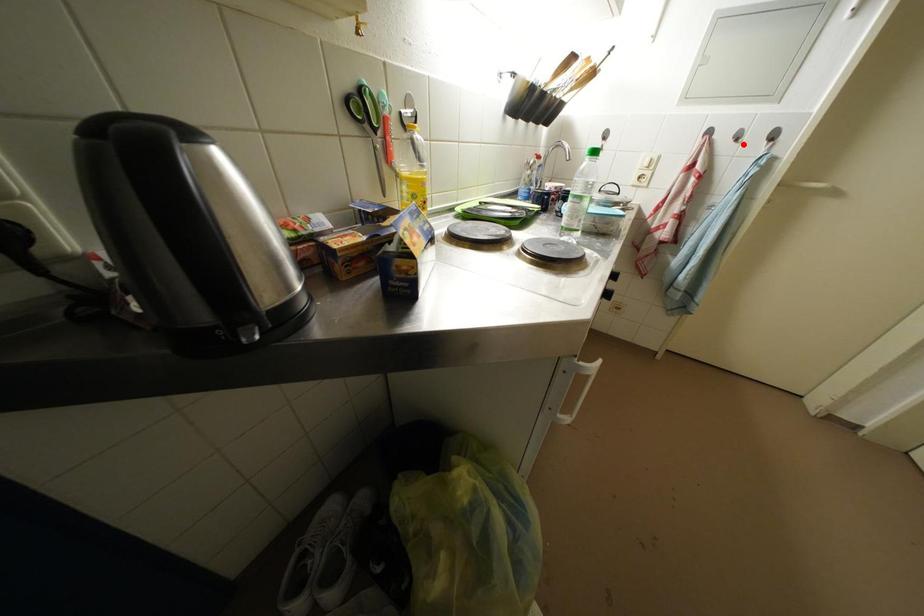
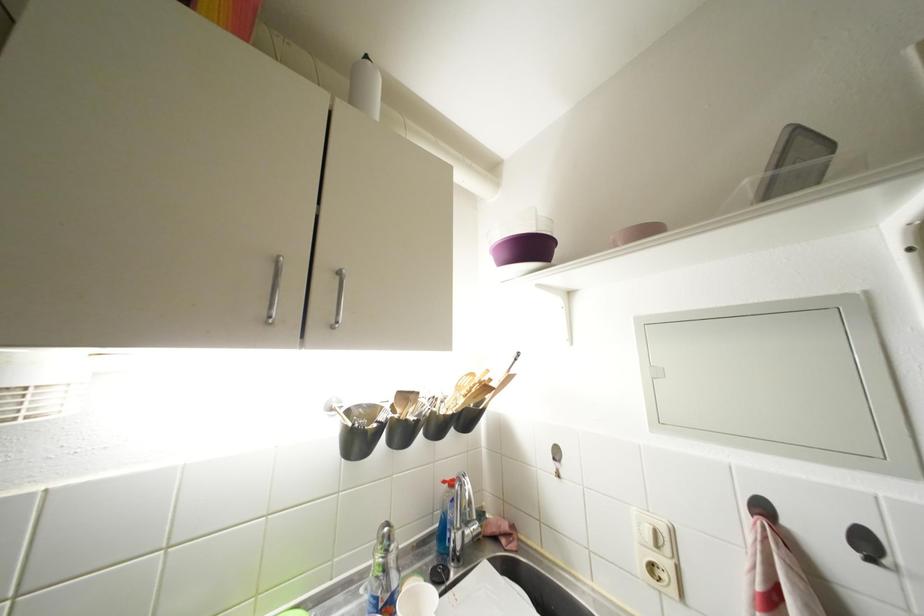
Where in the second image is the point corresponding to the highlighted location from the first image?

(877, 565)